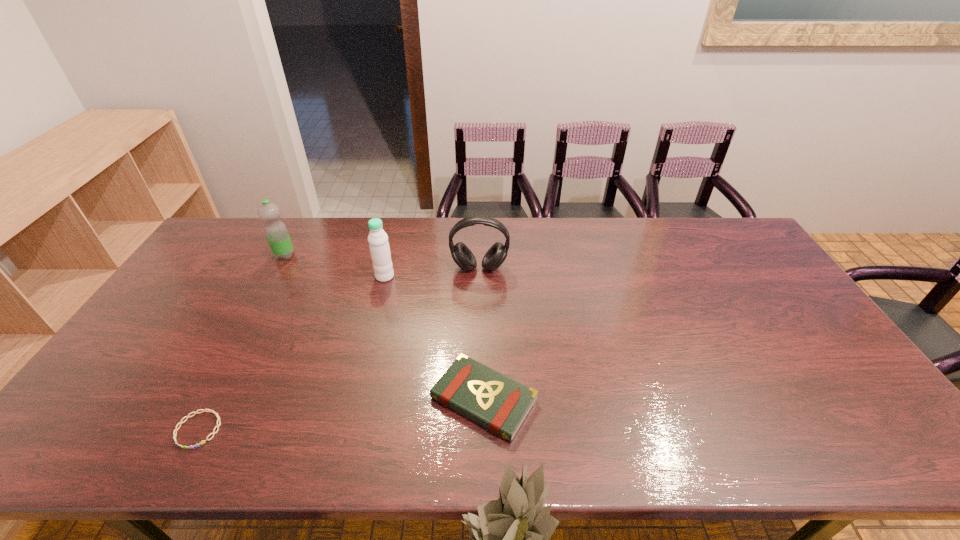
At what (x,y) coordinates should I click in order to perform the action: click on vacant area between the farther water bottle and the shortest object. Please return your answer as a coordinate pair (x, y). The image size is (960, 540). Looking at the image, I should click on (242, 343).

Where is `free space between the shortest object and the right water bottle`? This screenshot has width=960, height=540. free space between the shortest object and the right water bottle is located at coordinates (292, 353).

Find the location of `free space between the book and the headset`. free space between the book and the headset is located at coordinates (482, 334).

Identify the location of free space between the book and the headset. This screenshot has height=540, width=960. (482, 334).

Locate an element on the screen. The height and width of the screenshot is (540, 960). free spot between the farther water bottle and the book is located at coordinates (384, 328).

Select which object is the second closest to the headset. Please provide its 2D coordinates. Your answer should be formatted as a tuple, i.e. [(x, y)], where the tuple contains the x and y coordinates of a point satisfying the conditions above.

[(493, 400)]

What are the coordinates of `object that stands as the fourth closest to the shortest object` in the screenshot? It's located at (495, 256).

Image resolution: width=960 pixels, height=540 pixels. I want to click on free space that satisfies the following two spatial constraints: 1. on the front side of the book; 2. on the right side of the farther water bottle, so click(208, 399).

Identify the location of free location that satisfies the following two spatial constraints: 1. on the front side of the fourth tallest object; 2. on the right side of the farther water bottle. The width and height of the screenshot is (960, 540). (208, 399).